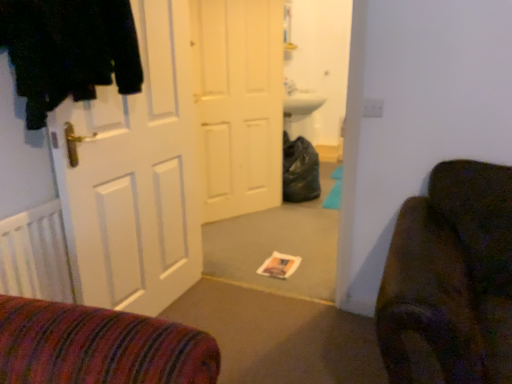
At what (x,y) coordinates should I click in order to perform the action: click on free location in front of white matte door at center, which is the second door in front-to-back order. Please return your answer as a coordinate pair (x, y). The width and height of the screenshot is (512, 384). Looking at the image, I should click on (246, 238).